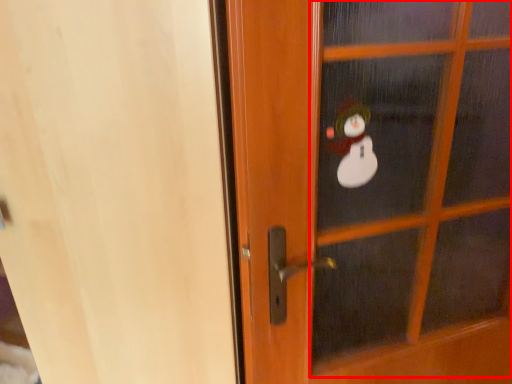
Question: From the image's perspective, where is screen door (annotated by the red box) located relative to screen door?

Choices:
 (A) above
 (B) below

Answer: (A)